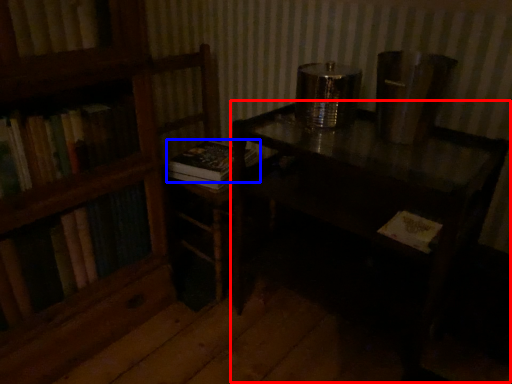
Question: Which point is closer to the camera, table (highlighted by a red box) or book (highlighted by a blue box)?

Choices:
 (A) table
 (B) book

Answer: (A)